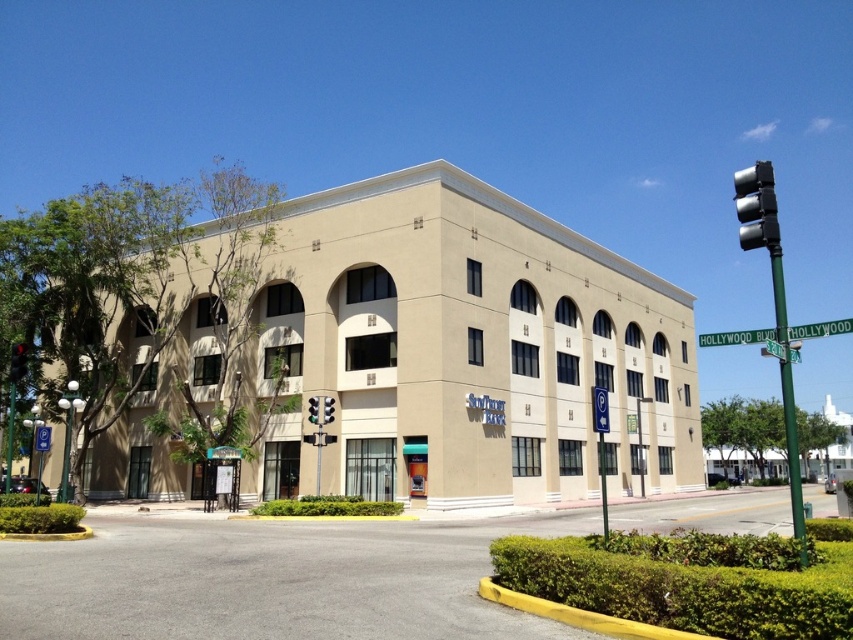
From the picture: Is green metallic pole at right wider than black plastic traffic light at upper right?

Indeed, green metallic pole at right has a greater width compared to black plastic traffic light at upper right.

What are the coordinates of `green metallic pole at right` in the screenshot? It's located at (787, 397).

Which is more to the right, green wood street sign at upper right or green glass traffic light at center?

From the viewer's perspective, green wood street sign at upper right appears more on the right side.

Between green wood street sign at upper right and green glass traffic light at center, which one is positioned lower?

green glass traffic light at center is below.

Does point (824, 323) come behind point (312, 401)?

Yes.

Locate an element on the screen. green wood street sign at upper right is located at coordinates (820, 328).

Does black plastic traffic light at left appear under green glass traffic light at center?

No.

Is point (13, 374) farther from viewer compared to point (318, 406)?

No, it is in front of (318, 406).

Who is more forward, (22,362) or (315,401)?

Positioned in front is point (22,362).

At what (x,y) coordinates should I click in order to perform the action: click on black plastic traffic light at left. Please return your answer as a coordinate pair (x, y). The width and height of the screenshot is (853, 640). Looking at the image, I should click on (18, 362).